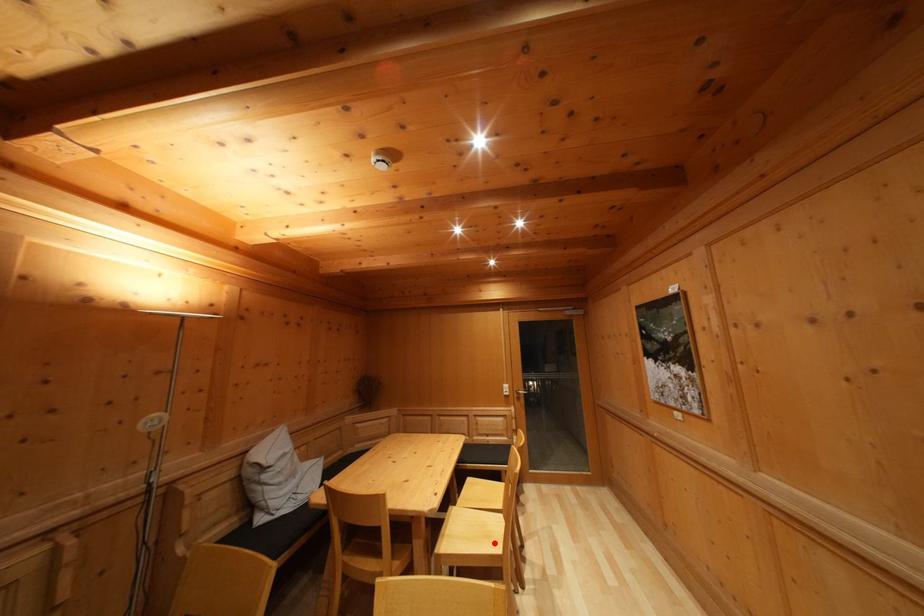
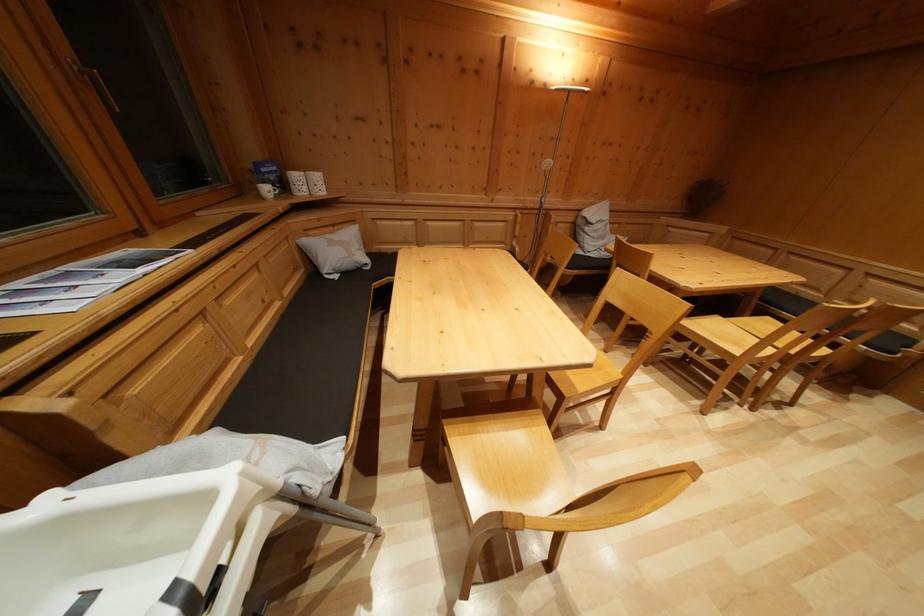
Locate, in the second image, the point that corresponds to the highlighted location in the first image.

(743, 352)